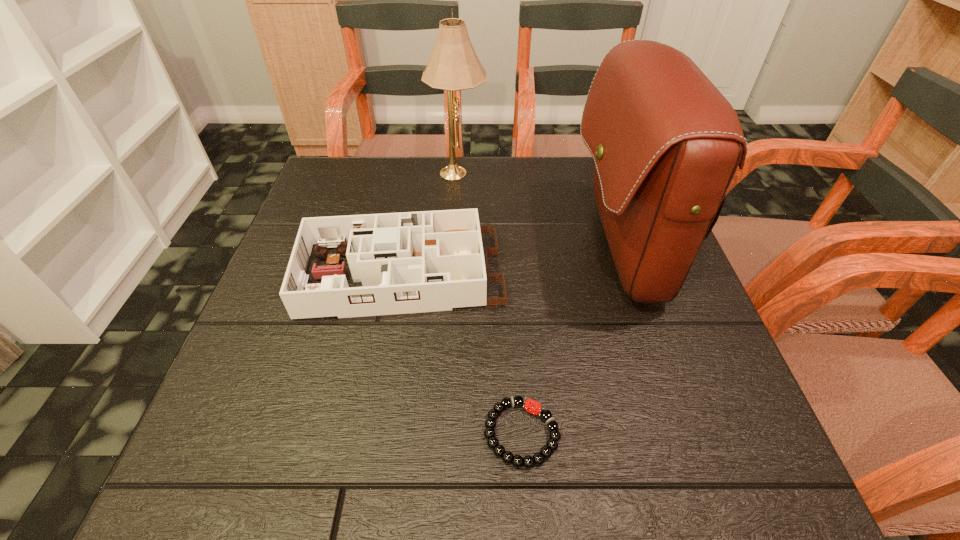
You are a GUI agent. You are given a task and a screenshot of the screen. Output one action in this format:
    pyautogui.click(x=<x>, y=<y>)
    Task: Click on the vacant area located on the left of the shortest object
    
    Given the screenshot: What is the action you would take?
    pyautogui.click(x=228, y=433)

Identify the location of lampshade situated at the far edge. The image size is (960, 540). (454, 65).

At what (x,y) coordinates should I click in order to perform the action: click on satchel situated at the far edge. Please return your answer as a coordinate pair (x, y). This screenshot has width=960, height=540. Looking at the image, I should click on (666, 143).

Find the location of a particular element. object located in the near edge section of the desktop is located at coordinates (538, 459).

The image size is (960, 540). Find the location of `object at the left edge`. object at the left edge is located at coordinates (411, 262).

I want to click on object that is positioned at the right edge, so click(666, 143).

Find the location of `object that is at the far right corner`. object that is at the far right corner is located at coordinates (666, 143).

The image size is (960, 540). Identify the location of vacant space at the far edge of the desktop. (573, 193).

This screenshot has width=960, height=540. In order to click on vacant space at the left edge in this screenshot , I will do `click(291, 252)`.

Where is `vacant area at the right edge of the desktop`? This screenshot has height=540, width=960. vacant area at the right edge of the desktop is located at coordinates (713, 367).